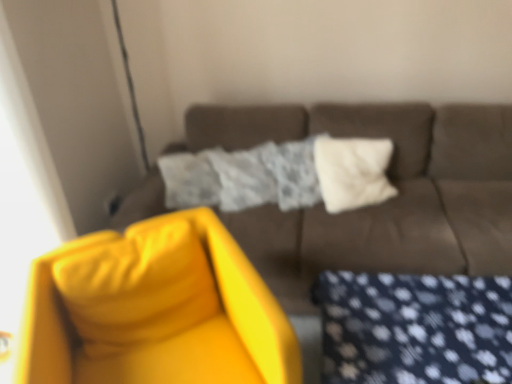
Question: Does matte brown couch at center appear on the right side of white soft pillow at center?

Choices:
 (A) no
 (B) yes

Answer: (A)

Question: Is matte brown couch at center at the left side of white soft pillow at center?

Choices:
 (A) yes
 (B) no

Answer: (A)

Question: Can you see matte brown couch at center touching white soft pillow at center?

Choices:
 (A) yes
 (B) no

Answer: (B)

Question: Is matte brown couch at center thinner than white soft pillow at center?

Choices:
 (A) yes
 (B) no

Answer: (B)

Question: From the image's perspective, is matte brown couch at center beneath white soft pillow at center?

Choices:
 (A) no
 (B) yes

Answer: (B)

Question: Is matte brown couch at center wider than white soft pillow at center?

Choices:
 (A) yes
 (B) no

Answer: (A)

Question: Considering the relative sizes of matte brown couch at center and matte yellow swivel chair at left in the image provided, is matte brown couch at center wider than matte yellow swivel chair at left?

Choices:
 (A) no
 (B) yes

Answer: (B)

Question: Is matte brown couch at center not near matte yellow swivel chair at left?

Choices:
 (A) no
 (B) yes

Answer: (A)

Question: Does matte brown couch at center have a lesser width compared to matte yellow swivel chair at left?

Choices:
 (A) yes
 (B) no

Answer: (B)

Question: From the image's perspective, is matte brown couch at center below matte yellow swivel chair at left?

Choices:
 (A) yes
 (B) no

Answer: (B)

Question: From a real-world perspective, is matte brown couch at center under matte yellow swivel chair at left?

Choices:
 (A) no
 (B) yes

Answer: (A)

Question: Would you say matte brown couch at center contains matte yellow swivel chair at left?

Choices:
 (A) no
 (B) yes

Answer: (A)

Question: From a real-world perspective, is matte yellow swivel chair at left located beneath matte brown couch at center?

Choices:
 (A) yes
 (B) no

Answer: (A)